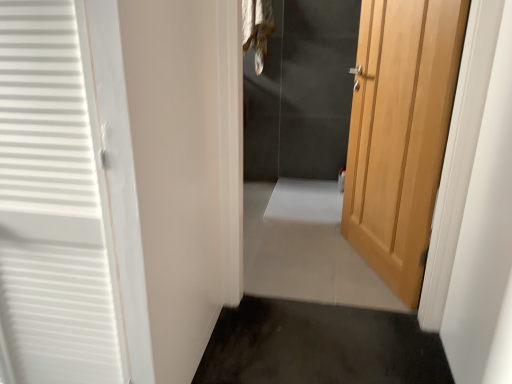
Question: Choose the correct answer: Is light wood door at right inside dark gray carpet at lower center, acting as the second path starting from the back, or outside it?

Choices:
 (A) outside
 (B) inside

Answer: (A)

Question: Looking at the image, does light wood door at right seem bigger or smaller compared to dark gray carpet at lower center, which ranks as the 2th path in top-to-bottom order?

Choices:
 (A) big
 (B) small

Answer: (A)

Question: Based on their relative distances, which object is farther from the white tile floor at center, which appears as the 2th path when ordered from the bottom?

Choices:
 (A) light wood door at right
 (B) dark gray carpet at lower center, acting as the second path starting from the back
 (C) fur-like fabric at upper center

Answer: (C)

Question: Estimate the real-world distances between objects in this image. Which object is farther from the fur-like fabric at upper center?

Choices:
 (A) white tile floor at center, the 2th path viewed from the front
 (B) light wood door at right
 (C) dark gray carpet at lower center, acting as the second path starting from the back

Answer: (C)